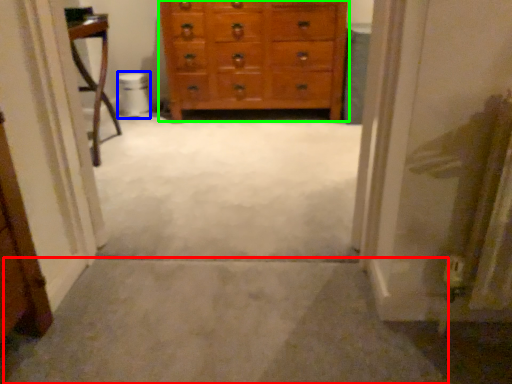
Question: Considering the real-world distances, which object is farthest from path (highlighted by a red box)? toilet bowl (highlighted by a blue box) or chest of drawers (highlighted by a green box)?

Choices:
 (A) toilet bowl
 (B) chest of drawers

Answer: (A)